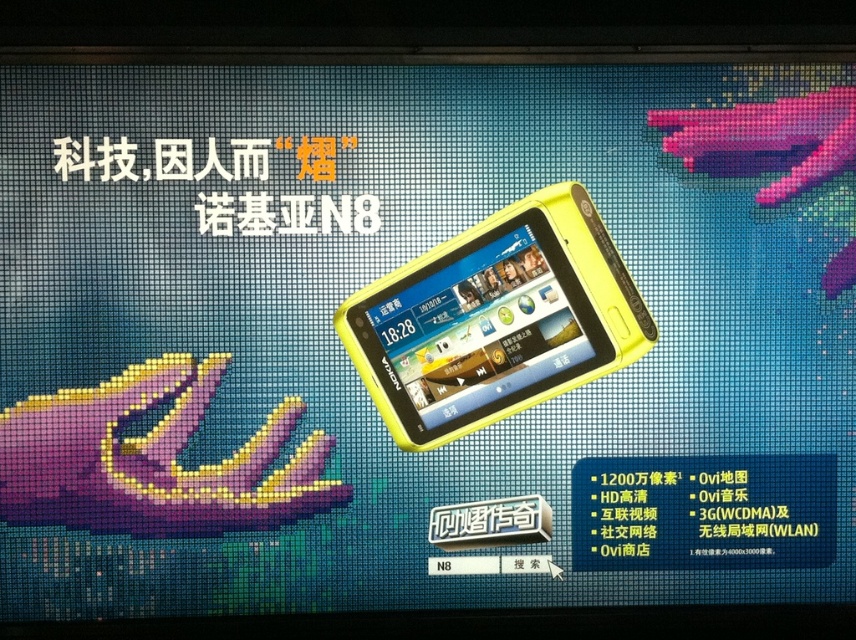
Image resolution: width=856 pixels, height=640 pixels. Describe the element at coordinates (495, 320) in the screenshot. I see `yellow plastic smartphone at center` at that location.

Who is positioned more to the left, yellow plastic smartphone at center or purple matte hand at lower left?

purple matte hand at lower left

Is point (568, 184) positioned in front of point (94, 461)?

Yes, it is in front of point (94, 461).

Find the location of a particular element. The width and height of the screenshot is (856, 640). yellow plastic smartphone at center is located at coordinates (495, 320).

Is yellow plastic smartphone at center closer to the viewer compared to matte pink plastic hand at upper right?

Yes, yellow plastic smartphone at center is closer to the viewer.

At what (x,y) coordinates should I click in order to perform the action: click on yellow plastic smartphone at center. Please return your answer as a coordinate pair (x, y). The image size is (856, 640). Looking at the image, I should click on (495, 320).

Is purple matte hand at lower left below matte pink plastic hand at upper right?

Yes, purple matte hand at lower left is below matte pink plastic hand at upper right.

Where is `purple matte hand at lower left`? purple matte hand at lower left is located at coordinates (153, 458).

Which is behind, point (128, 452) or point (765, 205)?

Positioned behind is point (128, 452).

Identify the location of purple matte hand at lower left. (x=153, y=458).